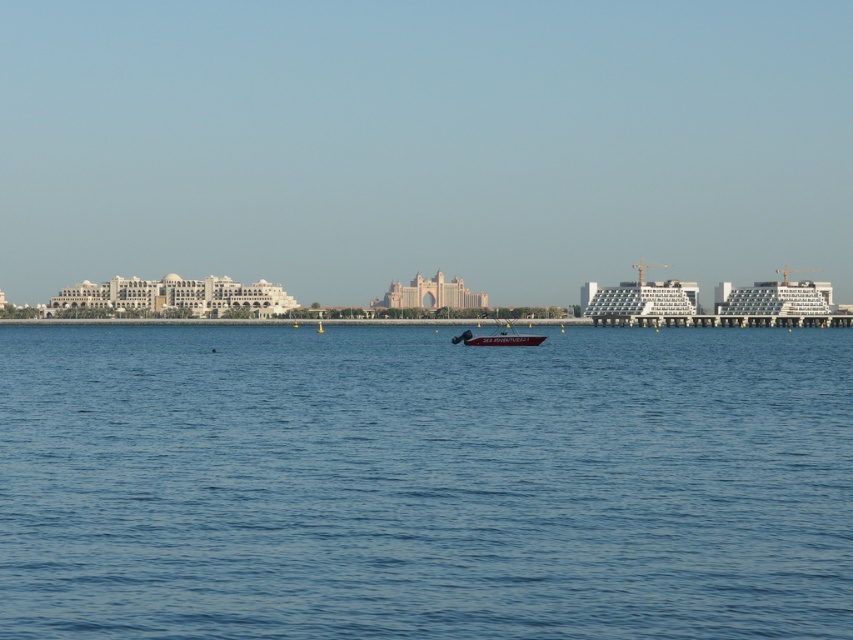
Is point (830, 483) closer to viewer compared to point (502, 328)?

Yes, it is in front of point (502, 328).

Is point (842, 618) behind point (541, 336)?

No.

At what (x,y) coordinates should I click in order to perform the action: click on blue water at center. Please return your answer as a coordinate pair (x, y). The image size is (853, 640). Looking at the image, I should click on (424, 483).